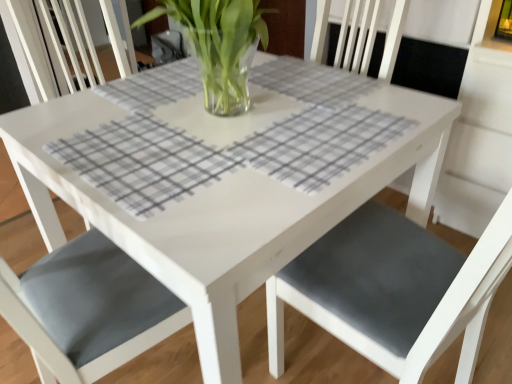
Identify the location of vacant space underneath clear glass vase at center (from a real-world perspective). This screenshot has height=384, width=512. (225, 110).